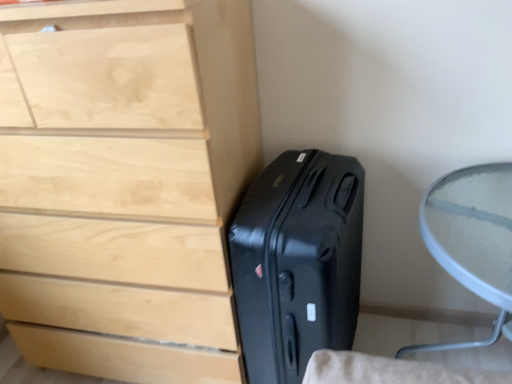
Question: Which is correct: light wood chest of drawers at left is inside transparent glass table at right, or outside of it?

Choices:
 (A) inside
 (B) outside

Answer: (B)

Question: Is light wood chest of drawers at left taller or shorter than transparent glass table at right?

Choices:
 (A) tall
 (B) short

Answer: (A)

Question: Estimate the real-world distances between objects in this image. Which object is closer to the transparent glass table at right?

Choices:
 (A) light wood chest of drawers at left
 (B) black hardshell suitcase at lower right

Answer: (B)

Question: Which of these objects is positioned farthest from the transparent glass table at right?

Choices:
 (A) black hardshell suitcase at lower right
 (B) light wood chest of drawers at left

Answer: (B)